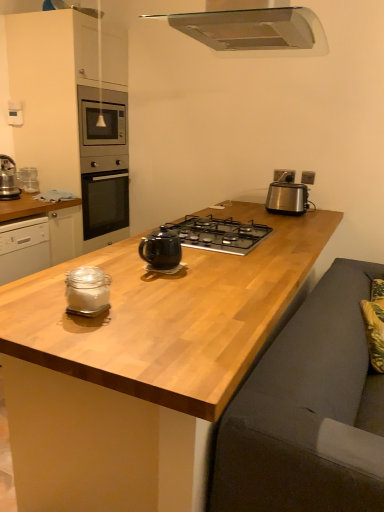
This screenshot has height=512, width=384. I want to click on free location to the right of clear glass jar at center, so click(x=153, y=310).